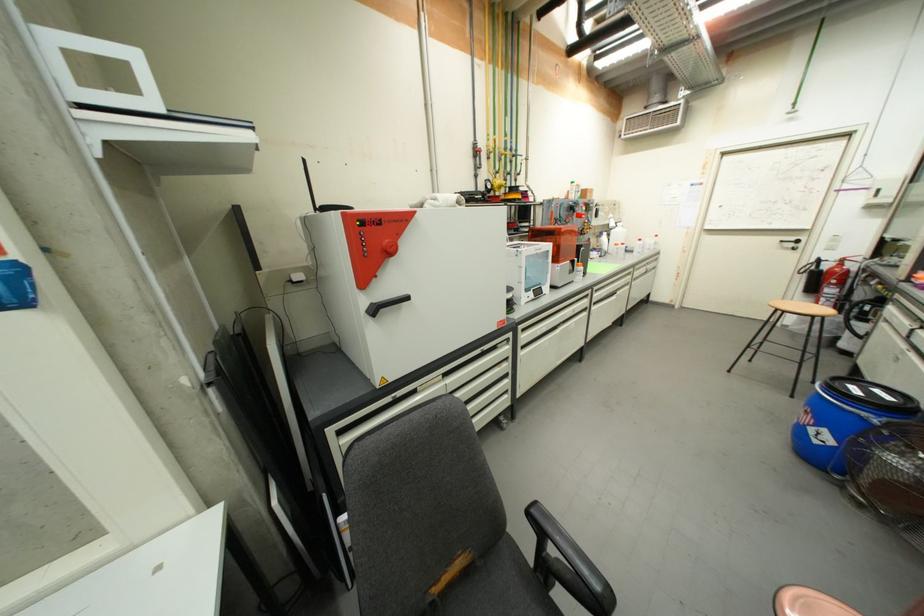
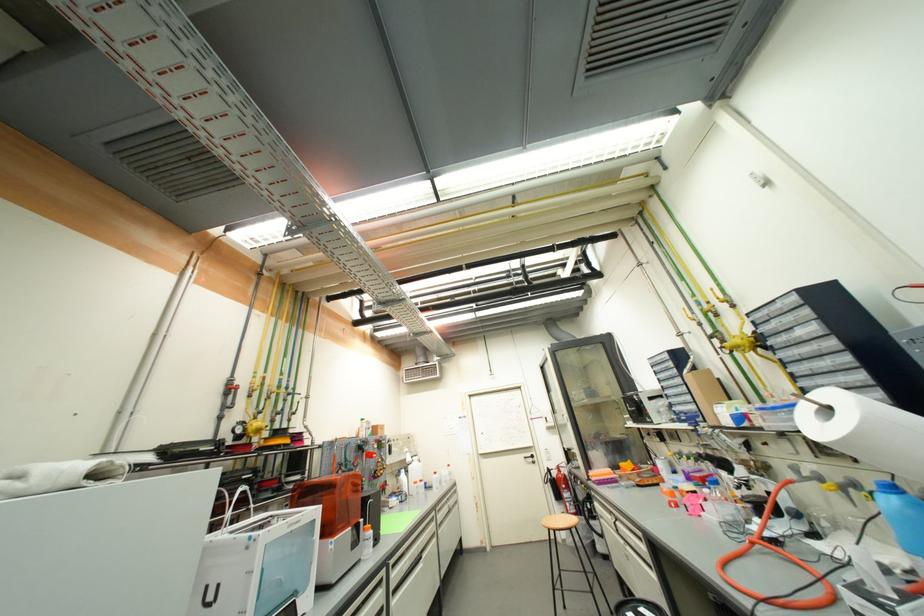
In the second image, find the point that corresponds to (x=786, y=243) in the first image.

(530, 459)